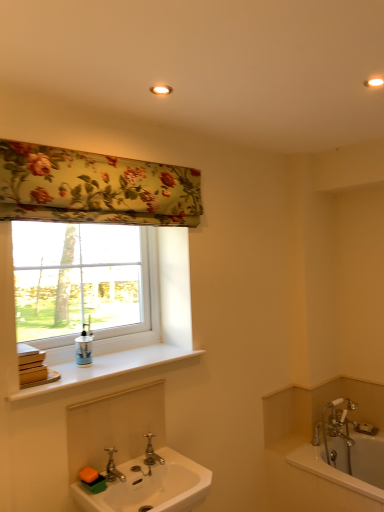
This screenshot has height=512, width=384. I want to click on empty space that is to the right of polished brass faucet at sink center, acting as the first tap starting from the right, so click(x=183, y=465).